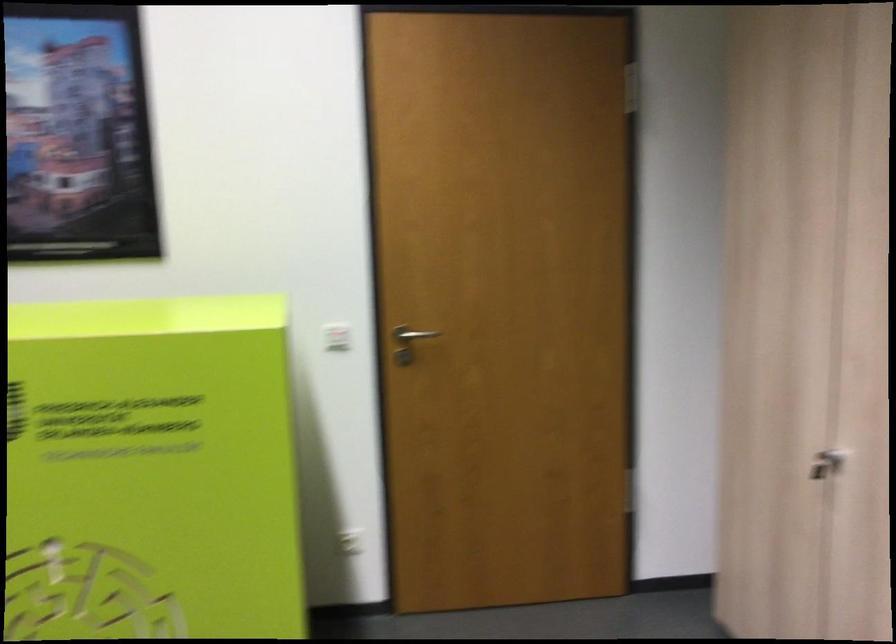
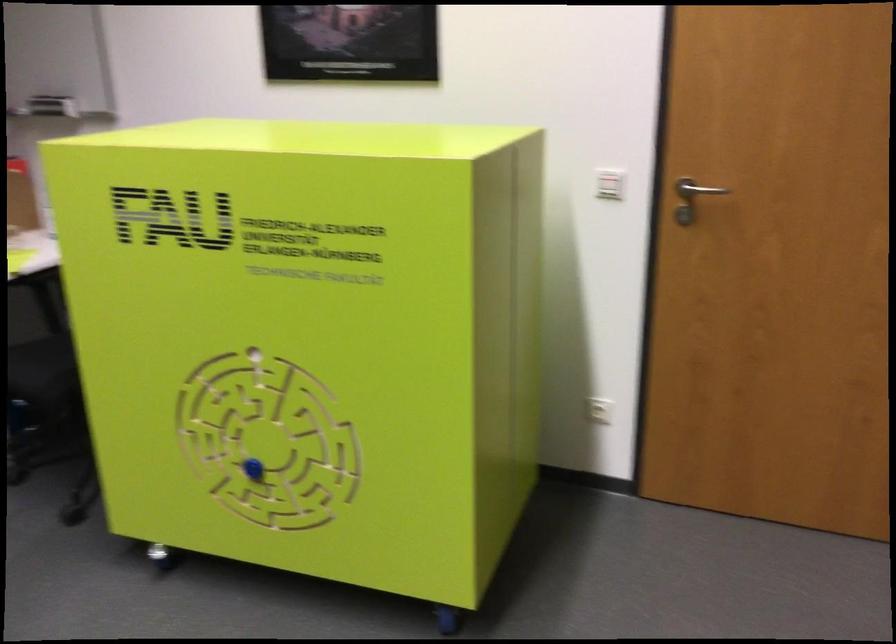
Locate, in the second image, the point that corresponds to (337,334) in the first image.

(609, 184)